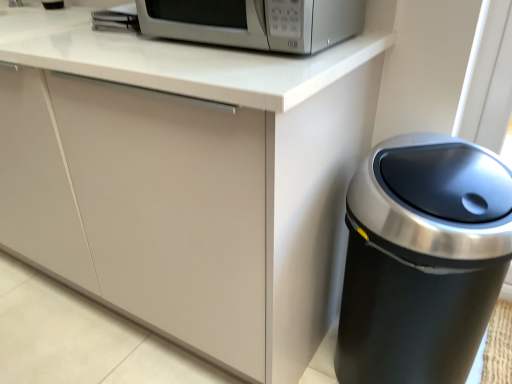
Question: Considering the relative sizes of satin silver microwave at upper center and black metallic trash can at right in the image provided, is satin silver microwave at upper center smaller than black metallic trash can at right?

Choices:
 (A) no
 (B) yes

Answer: (B)

Question: Considering the relative sizes of satin silver microwave at upper center and black metallic trash can at right in the image provided, is satin silver microwave at upper center wider than black metallic trash can at right?

Choices:
 (A) yes
 (B) no

Answer: (A)

Question: Can you see satin silver microwave at upper center touching black metallic trash can at right?

Choices:
 (A) no
 (B) yes

Answer: (A)

Question: Does satin silver microwave at upper center have a lesser height compared to black metallic trash can at right?

Choices:
 (A) no
 (B) yes

Answer: (B)

Question: Does satin silver microwave at upper center appear on the right side of black metallic trash can at right?

Choices:
 (A) yes
 (B) no

Answer: (B)

Question: From a real-world perspective, is satin silver microwave at upper center physically below black metallic trash can at right?

Choices:
 (A) no
 (B) yes

Answer: (A)

Question: From a real-world perspective, is black metallic trash can at right under satin silver microwave at upper center?

Choices:
 (A) yes
 (B) no

Answer: (A)

Question: Is black metallic trash can at right closer to the viewer compared to satin silver microwave at upper center?

Choices:
 (A) no
 (B) yes

Answer: (B)

Question: Is black metallic trash can at right to the left of satin silver microwave at upper center from the viewer's perspective?

Choices:
 (A) yes
 (B) no

Answer: (B)

Question: From a real-world perspective, is black metallic trash can at right over satin silver microwave at upper center?

Choices:
 (A) yes
 (B) no

Answer: (B)

Question: Is black metallic trash can at right not close to satin silver microwave at upper center?

Choices:
 (A) yes
 (B) no

Answer: (B)

Question: Could you tell me if black metallic trash can at right is turned towards satin silver microwave at upper center?

Choices:
 (A) yes
 (B) no

Answer: (B)

Question: Would you say black metallic trash can at right is to the left or to the right of satin silver microwave at upper center in the picture?

Choices:
 (A) left
 (B) right

Answer: (B)